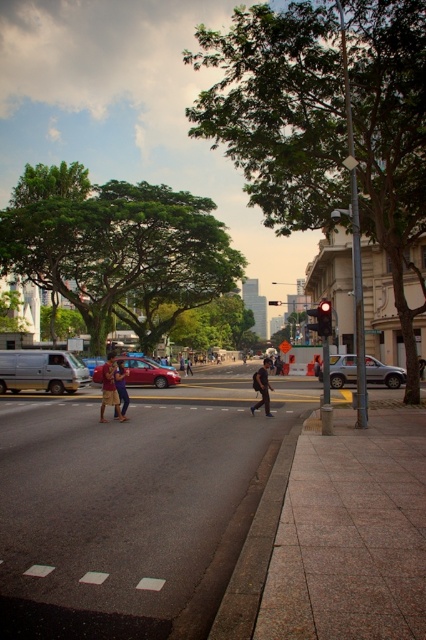
How far apart are green leafy tree at center and dark blue jeans at center?

85.97 meters

Which is above, green leafy tree at center or dark blue jeans at center?

Positioned higher is green leafy tree at center.

Which is behind, point (233, 113) or point (420, 362)?

Positioned behind is point (420, 362).

Locate an element on the screen. This screenshot has width=426, height=640. green leafy tree at center is located at coordinates (279, 109).

Between paved concrete sidewalk at lower right and brown leather jacket at center, which one has more height?

With more height is paved concrete sidewalk at lower right.

Is paved concrete sidewalk at lower right shorter than brown leather jacket at center?

In fact, paved concrete sidewalk at lower right may be taller than brown leather jacket at center.

At what (x,y) coordinates should I click in order to perform the action: click on paved concrete sidewalk at lower right. Please return your answer as a coordinate pair (x, y). The width and height of the screenshot is (426, 640). Looking at the image, I should click on (129, 512).

Find the location of a particular element. The height and width of the screenshot is (640, 426). paved concrete sidewalk at lower right is located at coordinates (129, 512).

Does paved concrete sidewalk at lower right come behind satin silver sedan at center-right?

No, paved concrete sidewalk at lower right is closer to the viewer.

Is paved concrete sidewalk at lower right wider than satin silver sedan at center-right?

Correct, the width of paved concrete sidewalk at lower right exceeds that of satin silver sedan at center-right.

Is point (146, 468) behind point (405, 378)?

No.

Find the location of `paved concrete sidewalk at lower right`. paved concrete sidewalk at lower right is located at coordinates (129, 512).